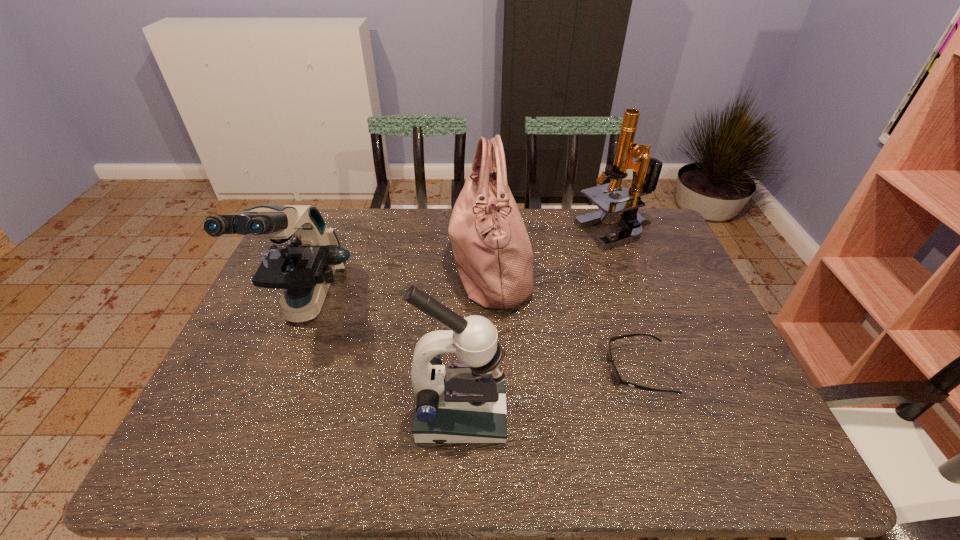
Where is `handbag`? The height and width of the screenshot is (540, 960). handbag is located at coordinates (493, 255).

I want to click on the rightmost microscope, so click(x=646, y=170).

Locate an element on the screen. This screenshot has height=540, width=960. the leftmost object is located at coordinates (305, 254).

Where is `the leftmost microscope`? the leftmost microscope is located at coordinates (305, 254).

The width and height of the screenshot is (960, 540). In order to click on the second microscope from right to left in this screenshot , I will do `click(465, 403)`.

Where is `the shortest object`? Image resolution: width=960 pixels, height=540 pixels. the shortest object is located at coordinates (618, 379).

Locate an element on the screen. The width and height of the screenshot is (960, 540). free space located 0.190m at the front of the handbag with handles is located at coordinates (388, 264).

You are a GUI agent. You are given a task and a screenshot of the screen. Output one action in this format:
    pyautogui.click(x=<x>, y=<y>)
    Task: Click on the vacant space situated at the front of the handbag with handles
    
    Given the screenshot: What is the action you would take?
    pyautogui.click(x=355, y=264)

This screenshot has height=540, width=960. I want to click on vacant space located at the front of the handbag with handles, so click(414, 264).

Identify the location of free spot located at the eyepiece of the rightmost microscope. The width and height of the screenshot is (960, 540). click(x=501, y=232).